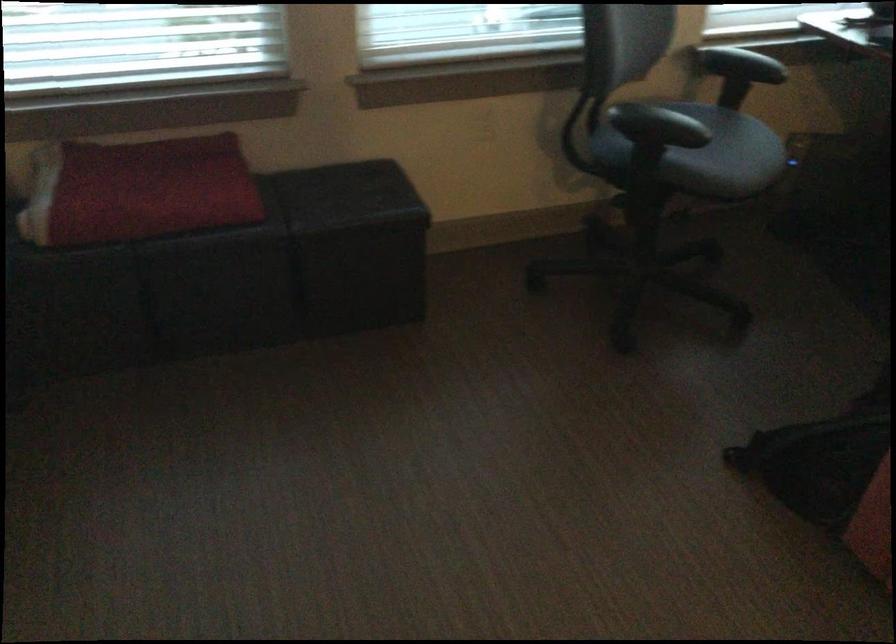
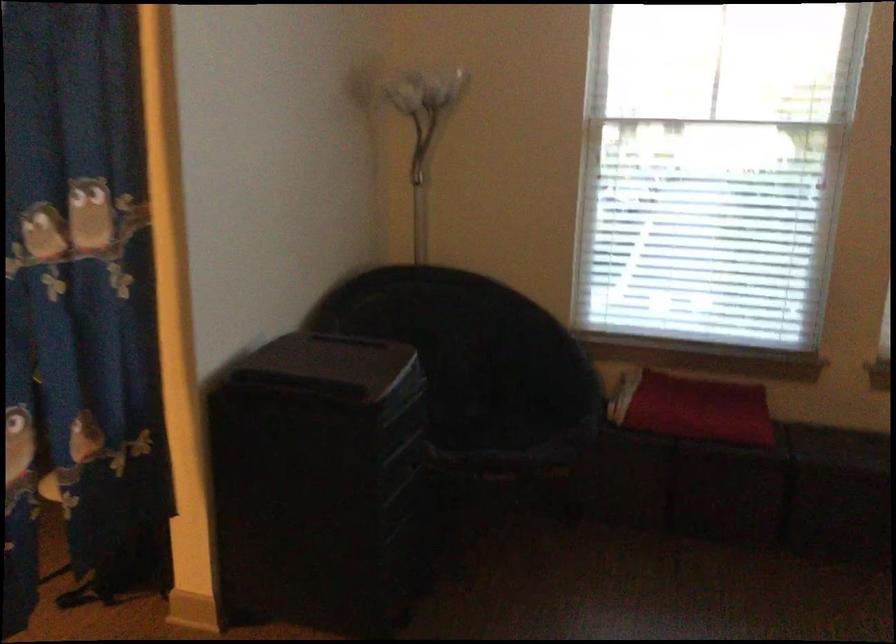
Question: Based on the continuous images, in which direction is the camera rotating? Reply with the corresponding letter.

Choices:
 (A) Left
 (B) Right
 (C) Up
 (D) Down

Answer: (A)